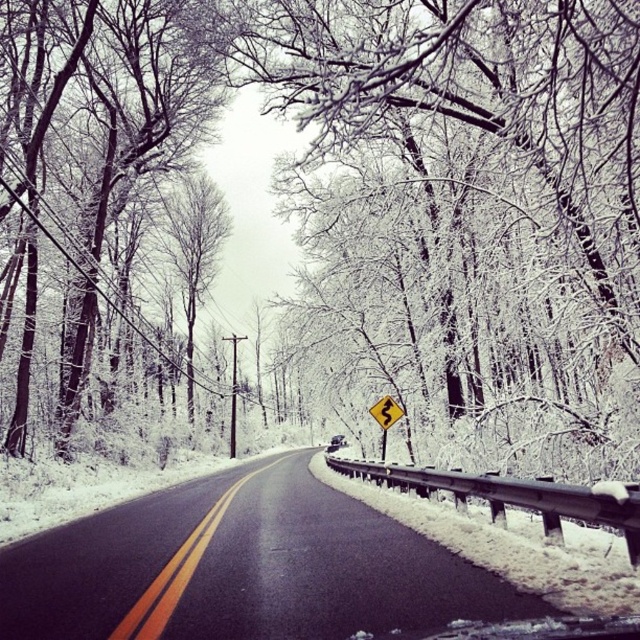
You are driving a car that is 15 feet long. You see the white frosty tree at left and the yellow reflective plastic at center ahead on the road. Can your car fit entirely between them without touching either?

The distance between the white frosty tree at left and the yellow reflective plastic at center is 56.56 feet. Since your car is only 15 feet long, it can easily fit between them without touching either object.

You are driving a car and need to stay on the black asphalt road at center while avoiding obstacles. Which direction should you steer to stay on the road if the white frosty tree at left is blocking your path?

The black asphalt road at center is below the white frosty tree at left, so steering downward would keep the car on the road while avoiding the tree.

You are a drone operator trying to capture a photo of the black asphalt road at center. Your camera has a very narrow field of view. To ensure the road is centered in your photo, where should you aim your camera? Please provide coordinates as a point in the format of a tuple with two decimal numbers between 0 and 1, where the first number is the x coordinate and the second is the y coordinate.

The black asphalt road at center is located at the coordinates point (243, 566), so you should aim your camera at point (243, 566) to center it in the photo.